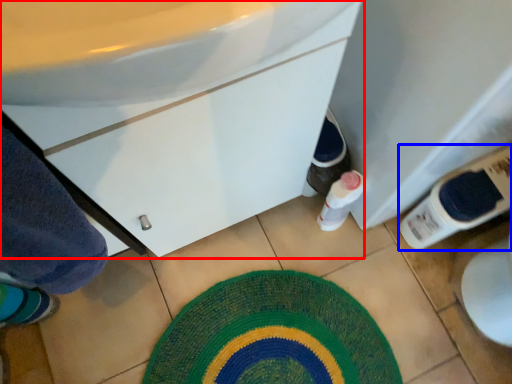
Question: Which object appears closest to the camera in this image, bathroom cabinet (highlighted by a red box) or bottle (highlighted by a blue box)?

Choices:
 (A) bathroom cabinet
 (B) bottle

Answer: (A)